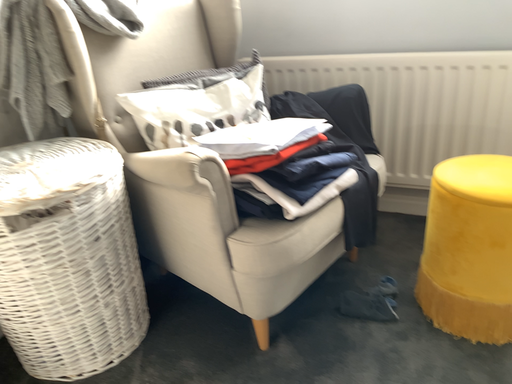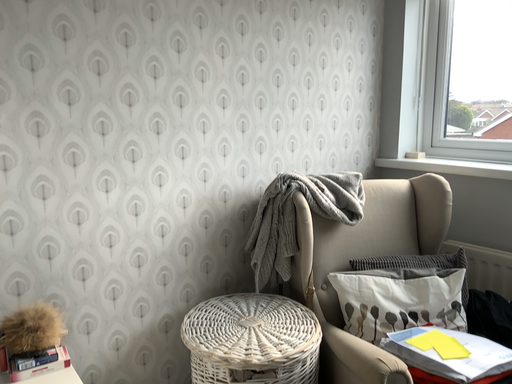
Question: Which way did the camera rotate in the video?

Choices:
 (A) rotated right
 (B) rotated left

Answer: (B)